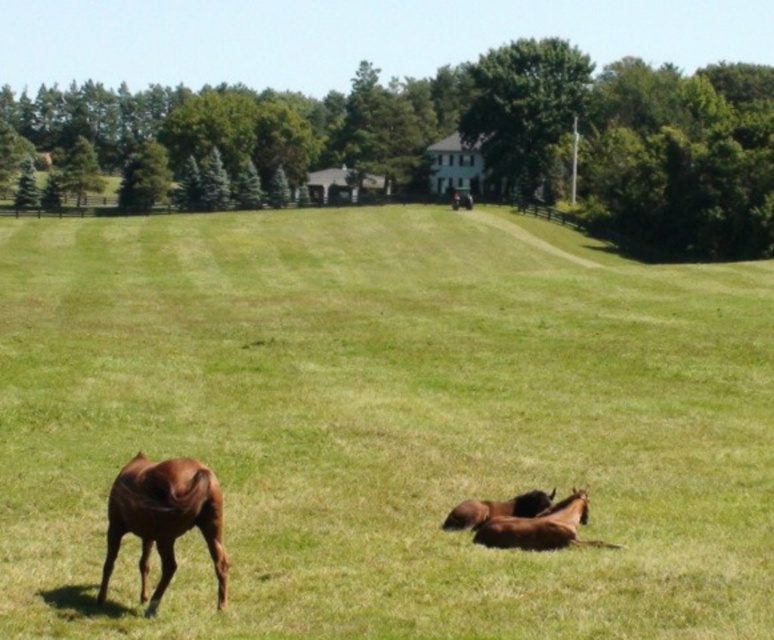
Can you confirm if brown glossy horse at lower left is positioned to the right of brown glossy horse at lower right?

Incorrect, brown glossy horse at lower left is not on the right side of brown glossy horse at lower right.

Is brown glossy horse at lower left thinner than brown glossy horse at lower right?

Yes.

Does point (139, 541) come in front of point (574, 506)?

Yes, it is in front of point (574, 506).

Identify the location of brown glossy horse at lower left. (163, 518).

Who is lower down, brown glossy horse at lower right or brown glossy horse at lower center?

brown glossy horse at lower right

Measure the distance between brown glossy horse at lower right and brown glossy horse at lower center.

brown glossy horse at lower right and brown glossy horse at lower center are 12.27 inches apart.

Where is `brown glossy horse at lower right`? brown glossy horse at lower right is located at coordinates (540, 528).

Does green grass pasture at center have a greater width compared to brown glossy horse at lower right?

Correct, the width of green grass pasture at center exceeds that of brown glossy horse at lower right.

Between green grass pasture at center and brown glossy horse at lower right, which one appears on the right side from the viewer's perspective?

Positioned to the right is green grass pasture at center.

Is point (574, 412) more distant than point (533, 522)?

That is True.

What are the coordinates of `green grass pasture at center` in the screenshot? It's located at (384, 422).